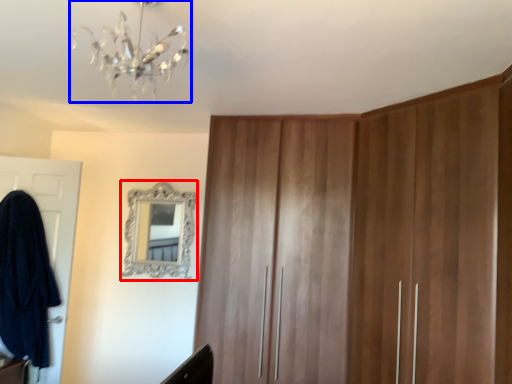
Question: Which of the following is the farthest to the observer, mirror (highlighted by a red box) or light fixture (highlighted by a blue box)?

Choices:
 (A) mirror
 (B) light fixture

Answer: (A)